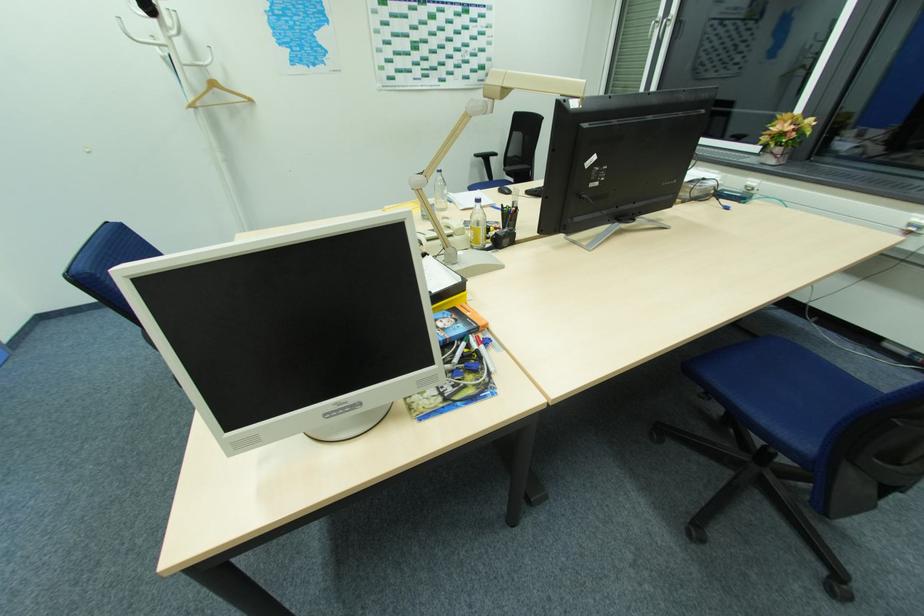
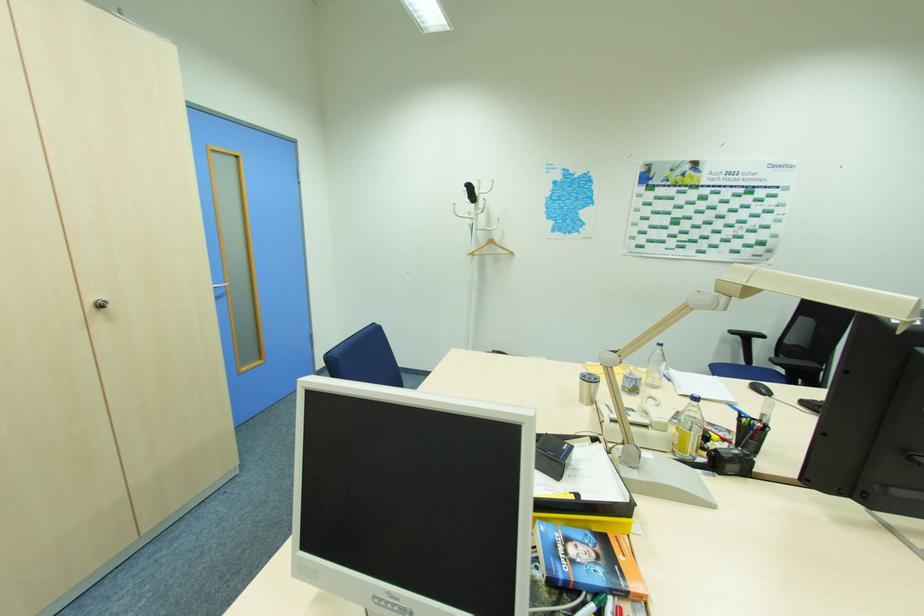
The point at (205, 63) is marked in the first image. Where is the corresponding point in the second image?

(492, 229)